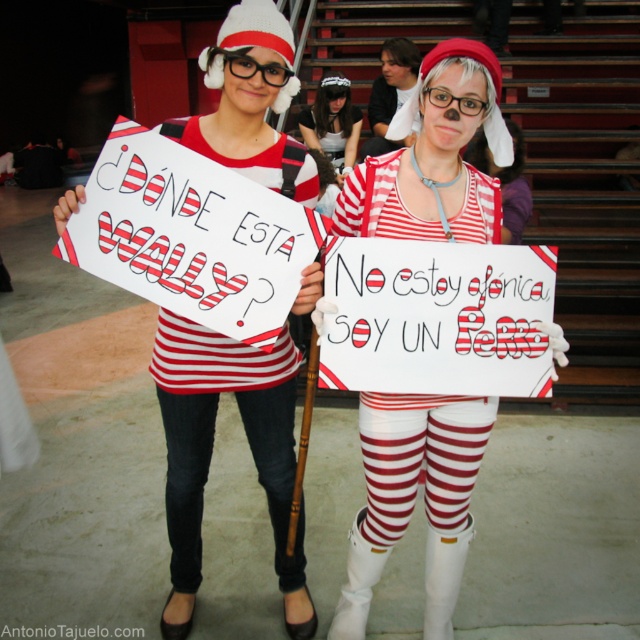
Can you confirm if white matte striped shirt at center is taller than white fabric headband at center?

Yes.

Who is taller, white matte striped shirt at center or white fabric headband at center?

Standing taller between the two is white matte striped shirt at center.

What do you see at coordinates (413, 497) in the screenshot?
I see `white matte striped shirt at center` at bounding box center [413, 497].

Identify the location of white matte striped shirt at center. The image size is (640, 640). [413, 497].